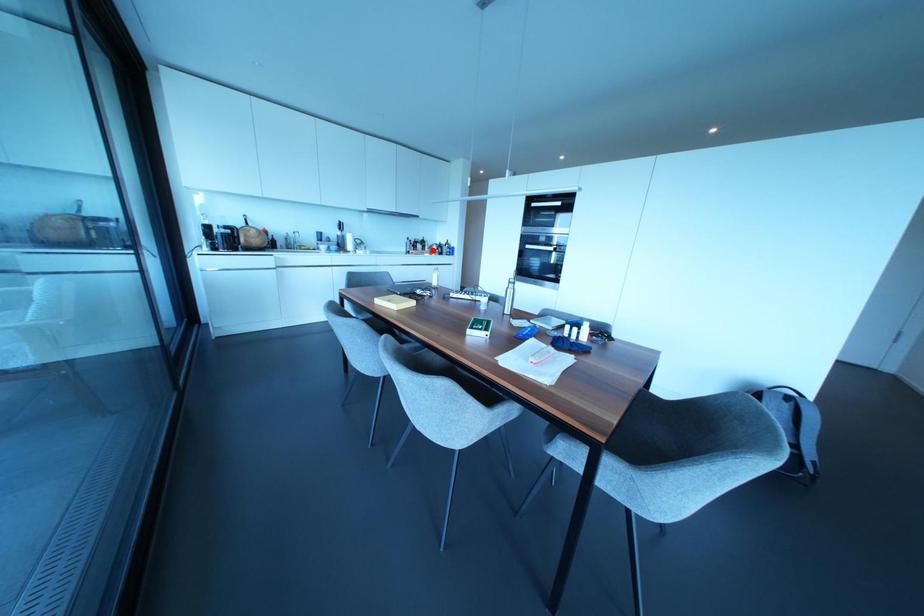
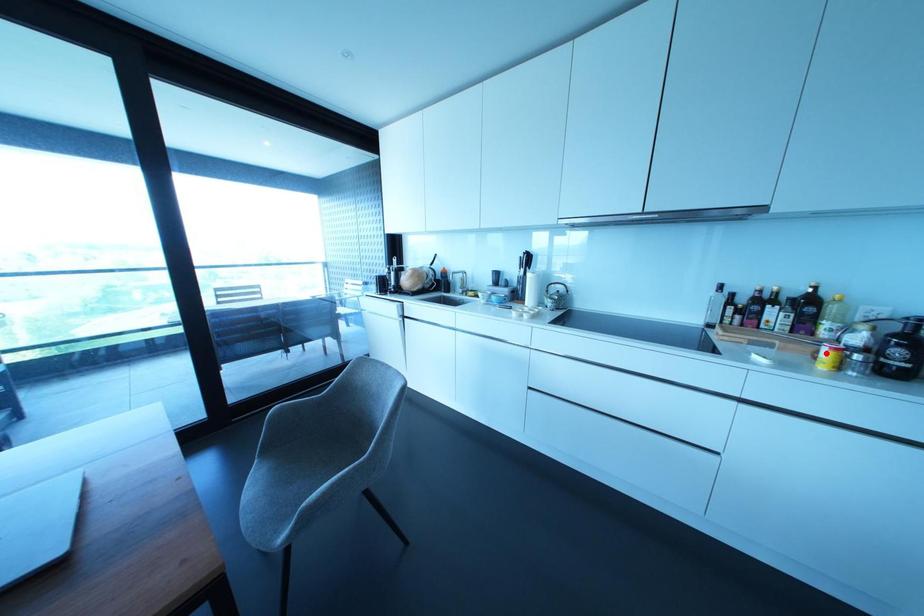
I am providing you with two images of the same scene from different viewpoints. A red point is marked on the first image and another point is marked on the second image. Do the highlighted points in image1 and image2 indicate the same real-world spot?

Yes